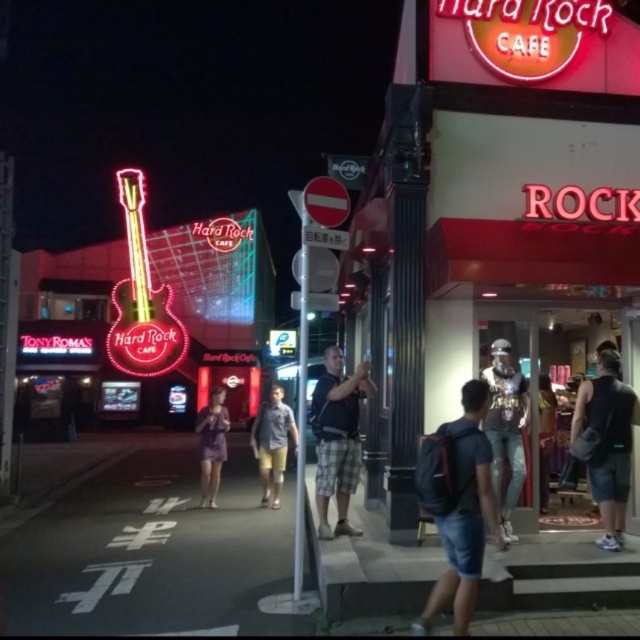
Question: Can you confirm if dark blue backpack at center is wider than dark gray plaid shorts at center?

Choices:
 (A) yes
 (B) no

Answer: (A)

Question: Which of the following is the farthest from the observer?

Choices:
 (A) yellow shorts at center
 (B) denim jeans at center
 (C) black fabric backpack at right
 (D) purple fabric dress at center

Answer: (D)

Question: Among these objects, which one is farthest from the camera?

Choices:
 (A) dark blue backpack at center
 (B) black fabric backpack at right
 (C) purple fabric dress at center

Answer: (C)

Question: Can you confirm if yellow shorts at center is wider than purple fabric dress at center?

Choices:
 (A) no
 (B) yes

Answer: (B)

Question: Does white asphalt at center appear on the left side of purple fabric dress at center?

Choices:
 (A) no
 (B) yes

Answer: (B)

Question: Which point is farther from the camera taking this photo?

Choices:
 (A) (204, 468)
 (B) (253, 454)

Answer: (B)